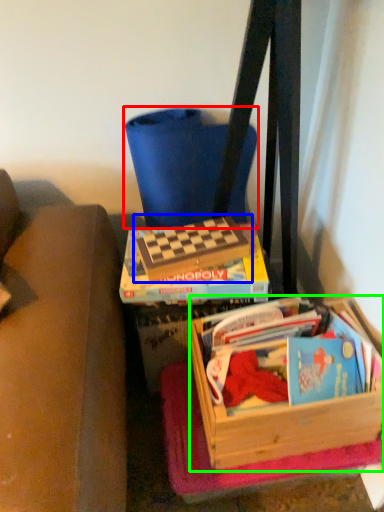
Question: Which object is positioned closest to folding chair (highlighted by a red box)? Select from paperback book (highlighted by a blue box) and box (highlighted by a green box).

Choices:
 (A) paperback book
 (B) box

Answer: (A)